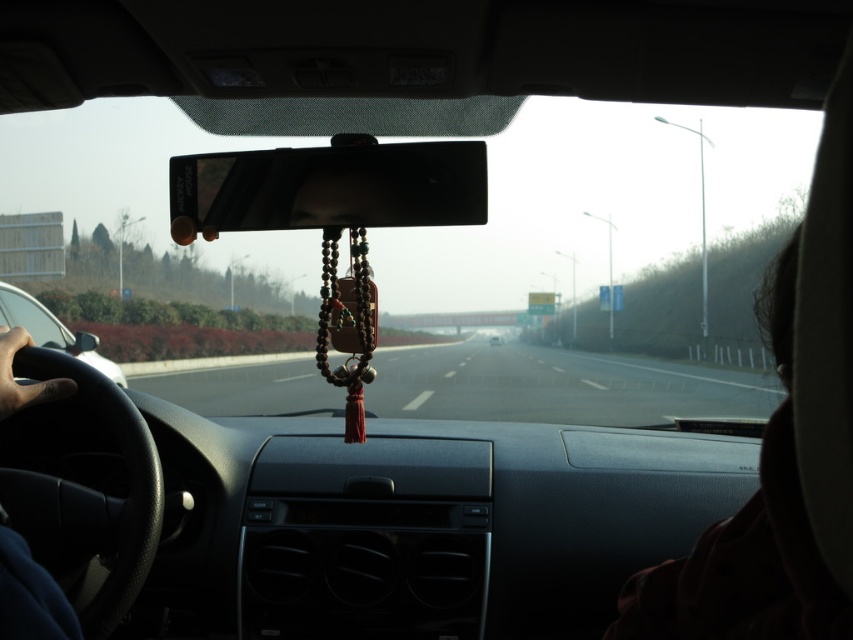
Question: Which is farther from the black glossy view mirror at center?

Choices:
 (A) black leather steering wheel at left
 (B) asphalt road at center
 (C) blue fabric hand at lower left

Answer: (B)

Question: Where is black glossy view mirror at center located in relation to black leather steering wheel at left in the image?

Choices:
 (A) right
 (B) left

Answer: (A)

Question: Can you confirm if dark hair at right is positioned above white glossy sedan at center?

Choices:
 (A) yes
 (B) no

Answer: (A)

Question: Which object is farther from the camera taking this photo?

Choices:
 (A) white glossy sedan at center
 (B) dark hair at right
 (C) black glossy view mirror at center

Answer: (A)

Question: Can you confirm if dark hair at right is positioned below white glossy sedan at center?

Choices:
 (A) no
 (B) yes

Answer: (A)

Question: Which point is farther to the camera?

Choices:
 (A) (44, 612)
 (B) (833, 621)

Answer: (A)